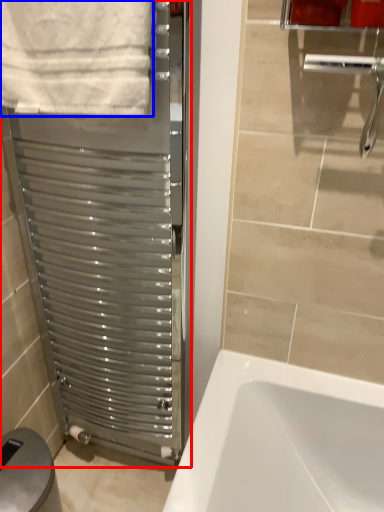
Question: Which object appears farthest to the camera in this image, screen door (highlighted by a red box) or towel (highlighted by a blue box)?

Choices:
 (A) screen door
 (B) towel

Answer: (A)